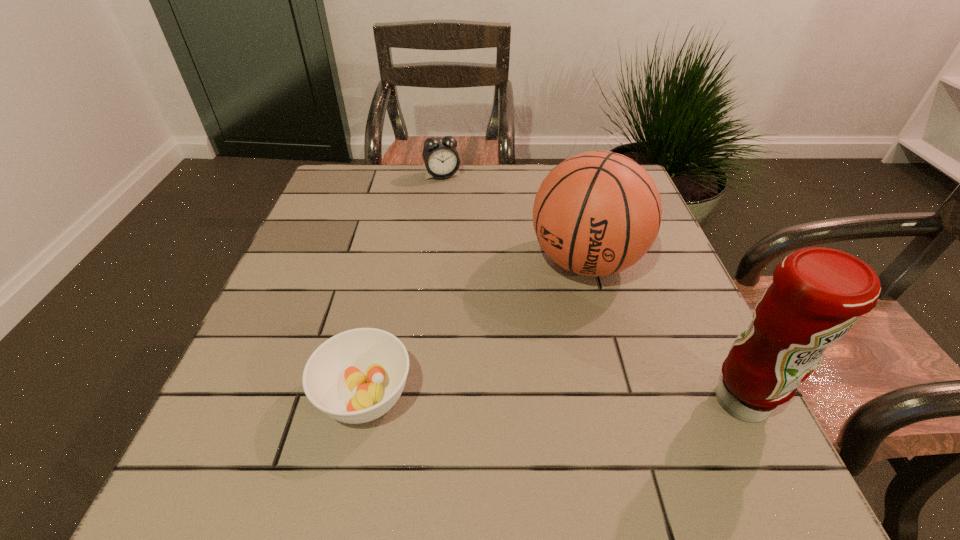
At what (x,y) coordinates should I click in order to perform the action: click on vacant space on the desktop that is between the shortest object and the condiment and is positioned on the surface of the second object from right to left near the brand logo. Please return your answer as a coordinate pair (x, y). Looking at the image, I should click on point(499,397).

Find the location of a particular element. Image resolution: width=960 pixels, height=540 pixels. vacant spot on the desktop that is between the soup bowl and the condiment and is positioned on the front side of the third tallest object is located at coordinates (537, 398).